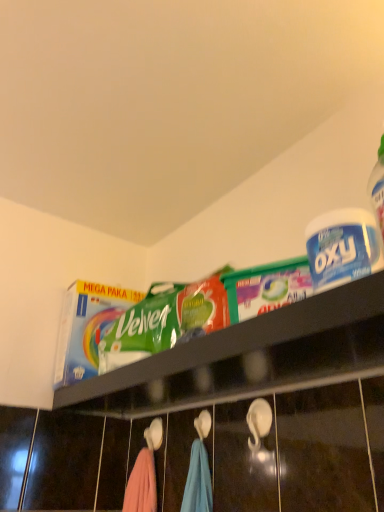
This screenshot has height=512, width=384. In order to click on white plastic container at upper right in this screenshot , I will do `click(342, 248)`.

Image resolution: width=384 pixels, height=512 pixels. What do you see at coordinates (342, 248) in the screenshot?
I see `white plastic container at upper right` at bounding box center [342, 248].

What is the approximate height of white plastic container at upper right?

The height of white plastic container at upper right is 4.97 inches.

The height and width of the screenshot is (512, 384). Describe the element at coordinates (249, 356) in the screenshot. I see `green plastic bag of velvet at upper center` at that location.

Locate an element on the screen. The image size is (384, 512). green plastic bag of velvet at upper center is located at coordinates (249, 356).

Find the location of a particular element. white plastic container at upper right is located at coordinates (342, 248).

Can you confirm if green plastic bag of velvet at upper center is positioned to the left of white plastic container at upper right?

Indeed, green plastic bag of velvet at upper center is positioned on the left side of white plastic container at upper right.

Is the position of green plastic bag of velvet at upper center less distant than that of white plastic container at upper right?

Yes, green plastic bag of velvet at upper center is in front of white plastic container at upper right.

Which point is more distant from viewer, (150, 388) or (323, 214)?

Positioned behind is point (150, 388).

From the image's perspective, is green plastic bag of velvet at upper center positioned above or below white plastic container at upper right?

green plastic bag of velvet at upper center is below white plastic container at upper right.

From a real-world perspective, between green plastic bag of velvet at upper center and white plastic container at upper right, who is vertically higher?

From a 3D spatial view, white plastic container at upper right is above.

Is green plastic bag of velvet at upper center wider or thinner than white plastic container at upper right?

Clearly, green plastic bag of velvet at upper center has more width compared to white plastic container at upper right.

Looking at this image, which of these two, green plastic bag of velvet at upper center or white plastic container at upper right, stands taller?

white plastic container at upper right is taller.

In terms of size, does green plastic bag of velvet at upper center appear bigger or smaller than white plastic container at upper right?

green plastic bag of velvet at upper center is bigger than white plastic container at upper right.

Would you say green plastic bag of velvet at upper center is inside or outside white plastic container at upper right?

green plastic bag of velvet at upper center is not enclosed by white plastic container at upper right.

Would you say green plastic bag of velvet at upper center is a long distance from white plastic container at upper right?

They are positioned close to each other.

Could you tell me if green plastic bag of velvet at upper center is facing white plastic container at upper right?

No, green plastic bag of velvet at upper center is not turned towards white plastic container at upper right.

You are a GUI agent. You are given a task and a screenshot of the screen. Output one action in this format:
    pyautogui.click(x=<x>, y=<y>)
    Task: Click on the shelf located in front of the white plastic container at upper right
    The image size is (384, 512).
    Given the screenshot: What is the action you would take?
    pyautogui.click(x=249, y=356)

Considering the positions of objects white plastic container at upper right and green plastic bag of velvet at upper center in the image provided, who is more to the right, white plastic container at upper right or green plastic bag of velvet at upper center?

Positioned to the right is white plastic container at upper right.

In the image, is white plastic container at upper right positioned in front of or behind green plastic bag of velvet at upper center?

Visually, white plastic container at upper right is located behind green plastic bag of velvet at upper center.

Between point (315, 238) and point (169, 400), which one is positioned behind?

The point (169, 400) is farther.

From the image's perspective, who appears lower, white plastic container at upper right or green plastic bag of velvet at upper center?

green plastic bag of velvet at upper center appears lower in the image.

From a real-world perspective, which is physically above, white plastic container at upper right or green plastic bag of velvet at upper center?

white plastic container at upper right is physically above.

Is white plastic container at upper right wider than green plastic bag of velvet at upper center?

Incorrect, the width of white plastic container at upper right does not surpass that of green plastic bag of velvet at upper center.

Who is shorter, white plastic container at upper right or green plastic bag of velvet at upper center?

green plastic bag of velvet at upper center.

From the picture: Considering the sizes of objects white plastic container at upper right and green plastic bag of velvet at upper center in the image provided, who is bigger, white plastic container at upper right or green plastic bag of velvet at upper center?

Bigger between the two is green plastic bag of velvet at upper center.

Choose the correct answer: Is white plastic container at upper right inside green plastic bag of velvet at upper center or outside it?

white plastic container at upper right cannot be found inside green plastic bag of velvet at upper center.

Are white plastic container at upper right and green plastic bag of velvet at upper center beside each other?

white plastic container at upper right and green plastic bag of velvet at upper center are not in contact.

Is white plastic container at upper right turned away from green plastic bag of velvet at upper center?

No.

What's the angular difference between white plastic container at upper right and green plastic bag of velvet at upper center's facing directions?

There is a 1.36-degree angle between the facing directions of white plastic container at upper right and green plastic bag of velvet at upper center.

The width and height of the screenshot is (384, 512). I want to click on shelf on the left side of white plastic container at upper right, so click(249, 356).

Locate an element on the screen. The width and height of the screenshot is (384, 512). shelf in front of the white plastic container at upper right is located at coordinates (249, 356).

Where is `product behind the green plastic bag of velvet at upper center`? This screenshot has width=384, height=512. product behind the green plastic bag of velvet at upper center is located at coordinates (342, 248).